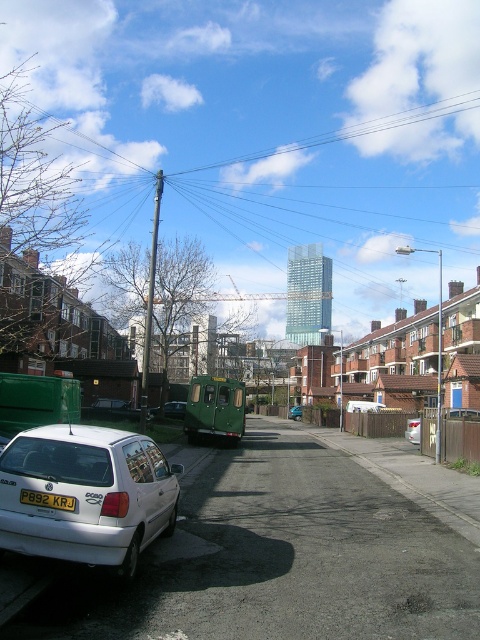
Question: Considering the relative positions of metallic silver car at center and metallic green bus at center in the image provided, where is metallic silver car at center located with respect to metallic green bus at center?

Choices:
 (A) left
 (B) right

Answer: (A)

Question: Is white plastic license plate at lower left bigger than metallic silver car at center?

Choices:
 (A) yes
 (B) no

Answer: (B)

Question: From the image, what is the correct spatial relationship of metallic silver car at center in relation to metallic green bus at center?

Choices:
 (A) below
 (B) above

Answer: (B)

Question: Which point is farther to the camera?

Choices:
 (A) white matte hatchback at lower left
 (B) metallic silver car at center
 (C) white matte car at center

Answer: (B)

Question: Which of these objects is positioned closest to the metallic silver car at center?

Choices:
 (A) white matte car at center
 (B) white plastic license plate at lower left

Answer: (A)

Question: Estimate the real-world distances between objects in this image. Which object is farther from the metallic green bus at center?

Choices:
 (A) metallic silver car at center
 (B) white matte hatchback at lower left
 (C) white plastic license plate at lower left
 (D) white matte car at center

Answer: (C)